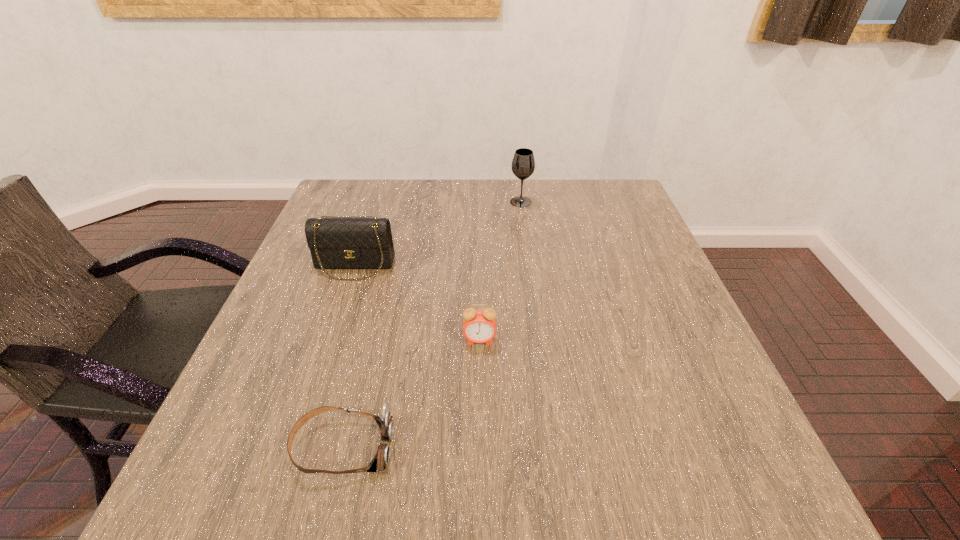
The height and width of the screenshot is (540, 960). Find the location of `free space between the third farthest object and the third nearest object`. free space between the third farthest object and the third nearest object is located at coordinates (417, 303).

Find the location of a particular element. The image size is (960, 540). free space between the alarm clock and the second tallest object is located at coordinates (417, 303).

This screenshot has width=960, height=540. I want to click on object that stands as the closest to the second shortest object, so click(385, 422).

This screenshot has height=540, width=960. Find the location of `object that is the closest to the nearest object`. object that is the closest to the nearest object is located at coordinates (479, 326).

This screenshot has height=540, width=960. In order to click on vacant space that satisfies the following two spatial constraints: 1. on the face of the third tallest object; 2. on the front-facing side of the goggles in this screenshot , I will do `click(480, 447)`.

Image resolution: width=960 pixels, height=540 pixels. I want to click on vacant area in the image that satisfies the following two spatial constraints: 1. on the face of the third object from left to right; 2. on the front-facing side of the shortest object, so click(x=480, y=447).

The image size is (960, 540). I want to click on free location that satisfies the following two spatial constraints: 1. on the face of the alarm clock; 2. on the front-facing side of the shortest object, so click(480, 447).